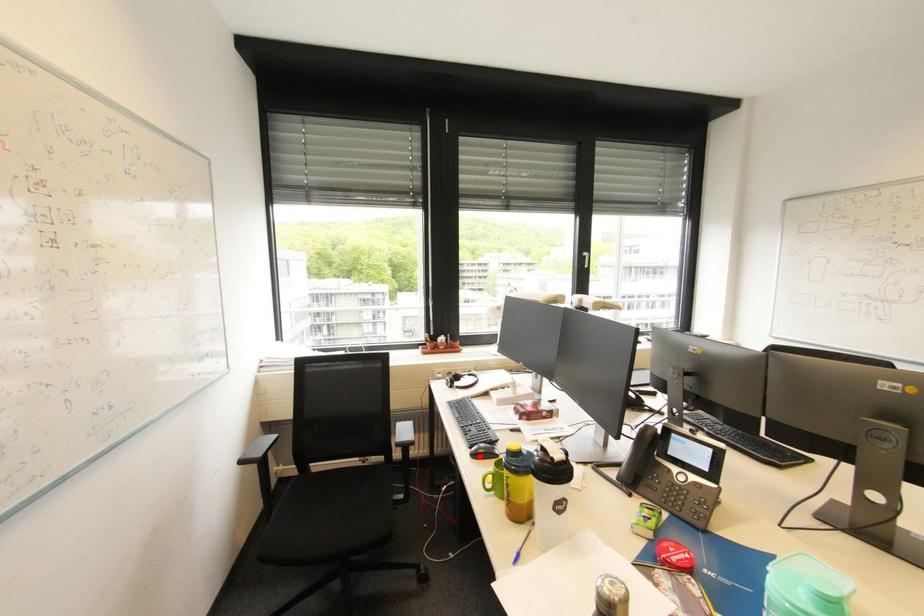
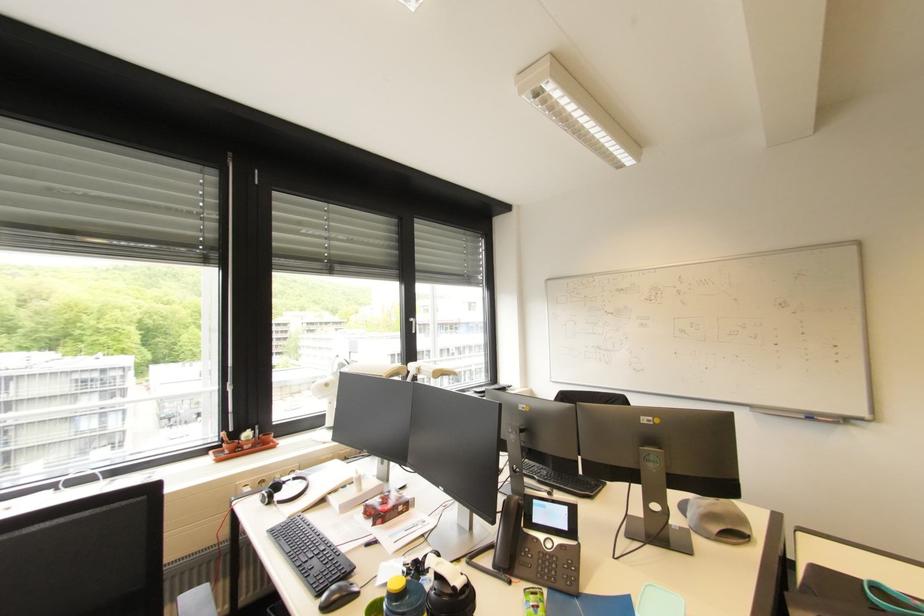
The point at the highlighted location is marked in the first image. Where is the corresponding point in the second image?

(332, 609)